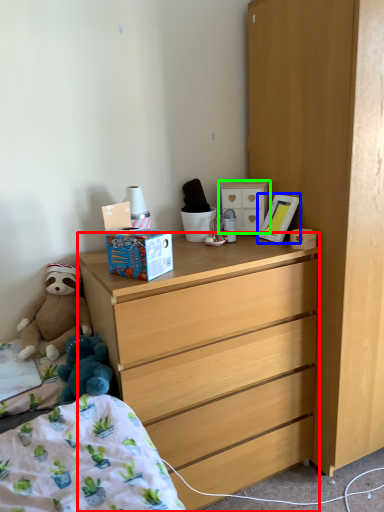
Question: Which is nearer to the desk (highlighted by a red box)? picture frame (highlighted by a blue box) or cabinetry (highlighted by a green box).

Choices:
 (A) picture frame
 (B) cabinetry

Answer: (A)